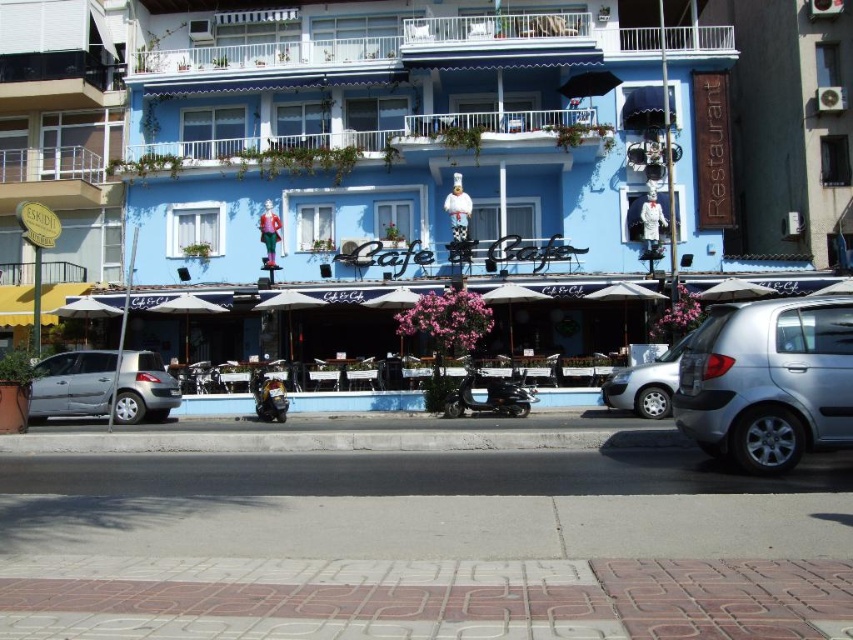
Question: Considering the relative positions of silver metallic car at center and shiny black motorcycle at center in the image provided, where is silver metallic car at center located with respect to shiny black motorcycle at center?

Choices:
 (A) right
 (B) left

Answer: (A)

Question: Which object appears closest to the camera in this image?

Choices:
 (A) silver metallic car at center
 (B) yellow awning at left

Answer: (A)

Question: Is silver metallic car at center wider than black matte scooter at center?

Choices:
 (A) no
 (B) yes

Answer: (A)

Question: Is yellow awning at left wider than silver metallic car at left?

Choices:
 (A) no
 (B) yes

Answer: (B)

Question: Estimate the real-world distances between objects in this image. Which object is closer to the black matte scooter at center?

Choices:
 (A) silver metallic car at center
 (B) yellow awning at left
 (C) silver metallic car at right

Answer: (A)

Question: Which of the following is the farthest from the observer?

Choices:
 (A) (172, 230)
 (B) (821, 403)
 (C) (53, 29)

Answer: (C)